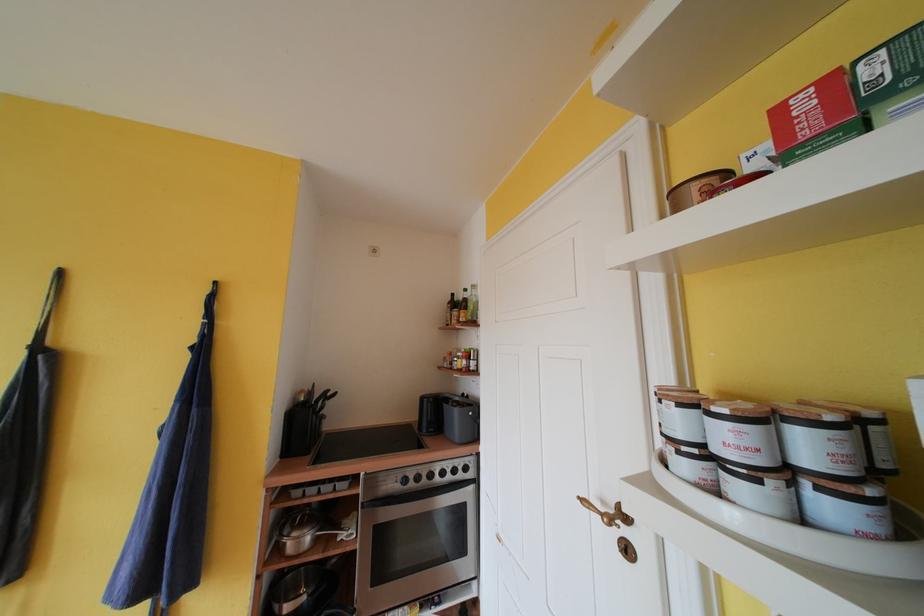
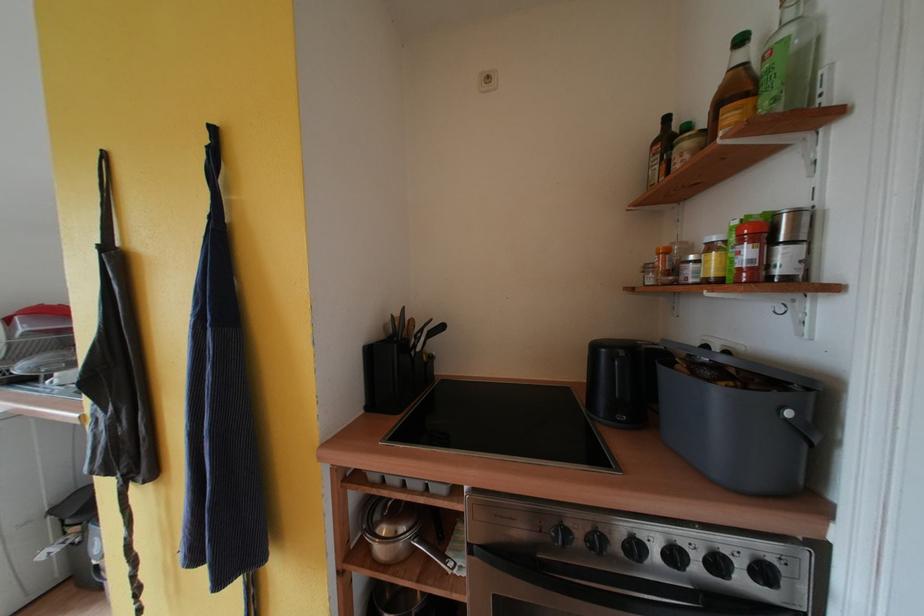
Question: The camera is either moving clockwise (left) or counter-clockwise (right) around the object. The first image is from the beginning of the video and the second image is from the end. Is the camera moving left or right when shooting the video?

Choices:
 (A) Left
 (B) Right

Answer: (B)